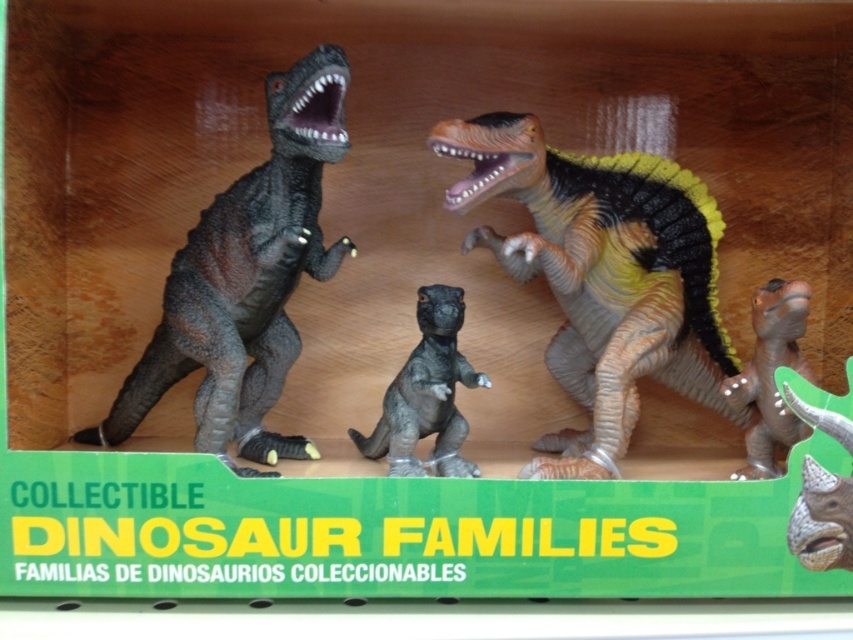
Question: Does brown matte dinosaur at center appear on the left side of matte gray plastic dinosaur head at lower right?

Choices:
 (A) no
 (B) yes

Answer: (A)

Question: Among these points, which one is farthest from the camera?

Choices:
 (A) (590, 166)
 (B) (239, 324)
 (C) (798, 301)

Answer: (A)

Question: Which of these objects is positioned farthest from the orange-yellow textured dinosaur at center?

Choices:
 (A) brown matte dinosaur at center
 (B) matte gray plastic dinosaur head at lower right

Answer: (B)

Question: Among these points, which one is farthest from the camera?

Choices:
 (A) (415, 410)
 (B) (851, 515)
 (C) (698, 221)
 (D) (212, 333)

Answer: (C)

Question: Can you confirm if matte black dinosaur at left is positioned to the right of brown matte dinosaur at center?

Choices:
 (A) no
 (B) yes

Answer: (A)

Question: Is matte black dinosaur at left above brown matte dinosaur at center?

Choices:
 (A) yes
 (B) no

Answer: (A)